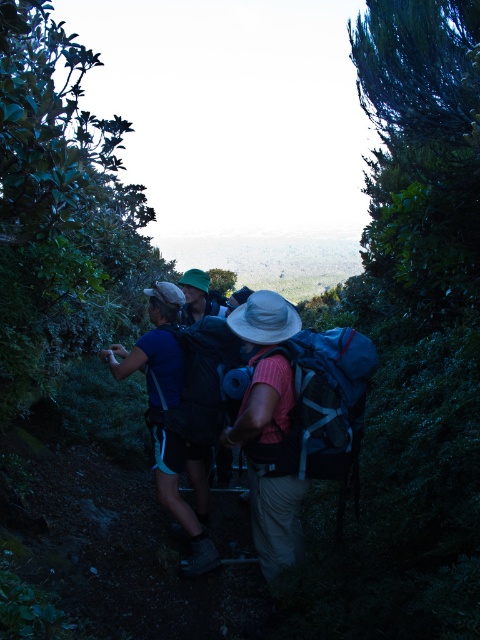
You are a hiker on the trail and want to reach the point at coordinates point (x=272, y=465). You are currently at point (x=199, y=410). According to the scene, which direction should you move to get closer to your destination?

Since point (x=272, y=465) is in front of point (x=199, y=410), you should move forward along the trail to reach your destination.

In the scene shown: You are a hiker planning to take a photo of the matte black backpacks at center. Where should you position yourself to capture them in the frame?

The matte black backpacks at center are located at point (276,522), so you should position yourself facing that coordinate to capture them in the frame.

You are a hiker planning to join the group. You see the blue fabric backpack at center and the matte black backpack at center. Which backpack would you need to adjust your stride more to avoid bumping into while walking on the narrow trail?

The blue fabric backpack at center is larger in size than the matte black backpack at center, so you would need to adjust your stride more to avoid bumping into the blue fabric backpack at center while walking on the narrow trail.